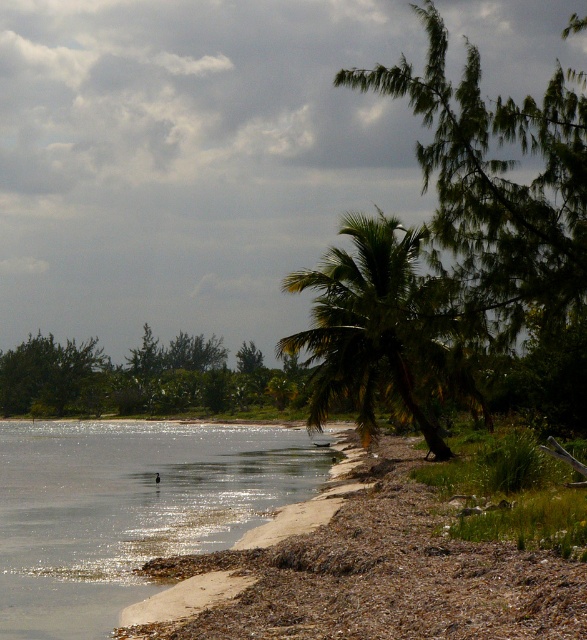
Does clear water at lower left lie in front of green leafy palm tree at center?

No.

Who is more forward, (14, 632) or (328, 276)?

Point (14, 632) is more forward.

The width and height of the screenshot is (587, 640). Identify the location of clear water at lower left. (129, 508).

Between green leafy palm tree at center and green leafy tree at center, which one is positioned higher?

green leafy palm tree at center

Which is more to the right, green leafy palm tree at center or green leafy tree at center?

Positioned to the right is green leafy palm tree at center.

Is point (339, 292) positioned in front of point (170, 349)?

Yes, it is.

Image resolution: width=587 pixels, height=640 pixels. In order to click on green leafy palm tree at center in this screenshot , I will do `click(384, 330)`.

Does clear water at lower left have a lesser width compared to green leafy tree at center?

Yes, clear water at lower left is thinner than green leafy tree at center.

You are a GUI agent. You are given a task and a screenshot of the screen. Output one action in this format:
    pyautogui.click(x=<x>, y=<y>)
    Task: Click on the clear water at lower left
    This screenshot has width=587, height=640.
    Given the screenshot: What is the action you would take?
    click(129, 508)